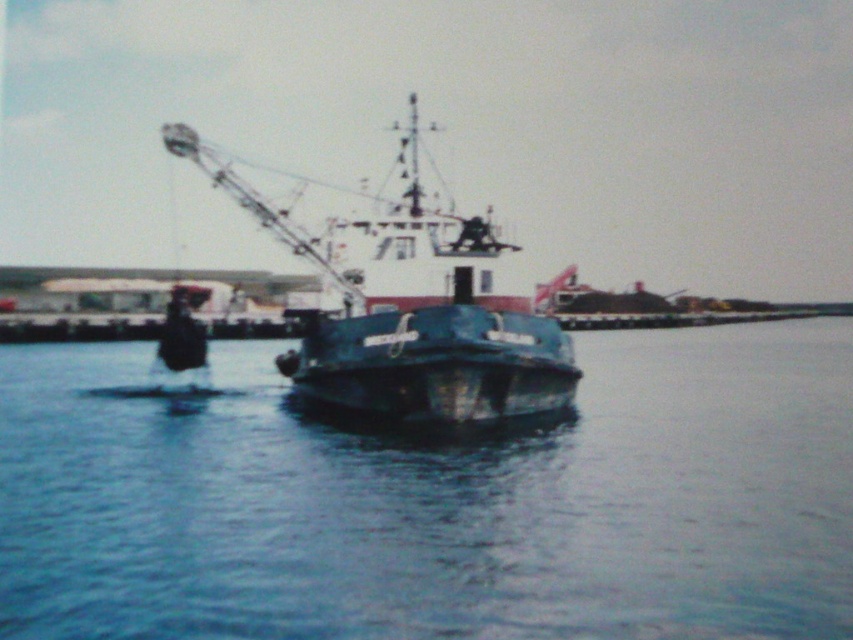
Question: Which point appears farthest from the camera in this image?

Choices:
 (A) (352, 518)
 (B) (422, 339)

Answer: (B)

Question: Is blue matte water at center to the right of blue metallic boat at center from the viewer's perspective?

Choices:
 (A) yes
 (B) no

Answer: (A)

Question: From the image, what is the correct spatial relationship of blue matte water at center in relation to blue metallic boat at center?

Choices:
 (A) left
 (B) right

Answer: (B)

Question: Is blue matte water at center below blue metallic boat at center?

Choices:
 (A) no
 (B) yes

Answer: (B)

Question: Which of the following is the farthest from the observer?

Choices:
 (A) blue metallic boat at center
 (B) blue matte water at center

Answer: (A)